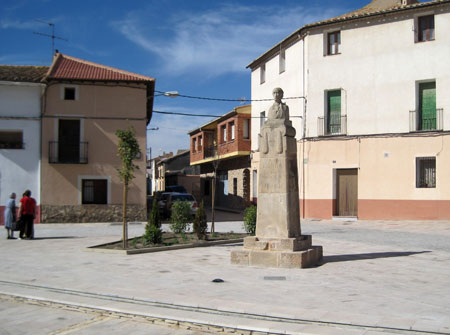
Locate an element on the screen. barred window is located at coordinates (427, 180).